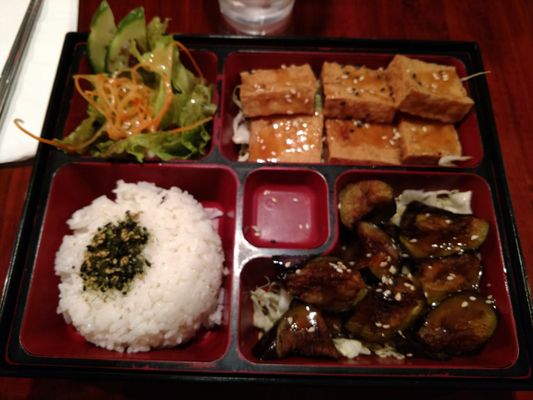
Identify the location of napkin. This screenshot has width=533, height=400. (37, 43).